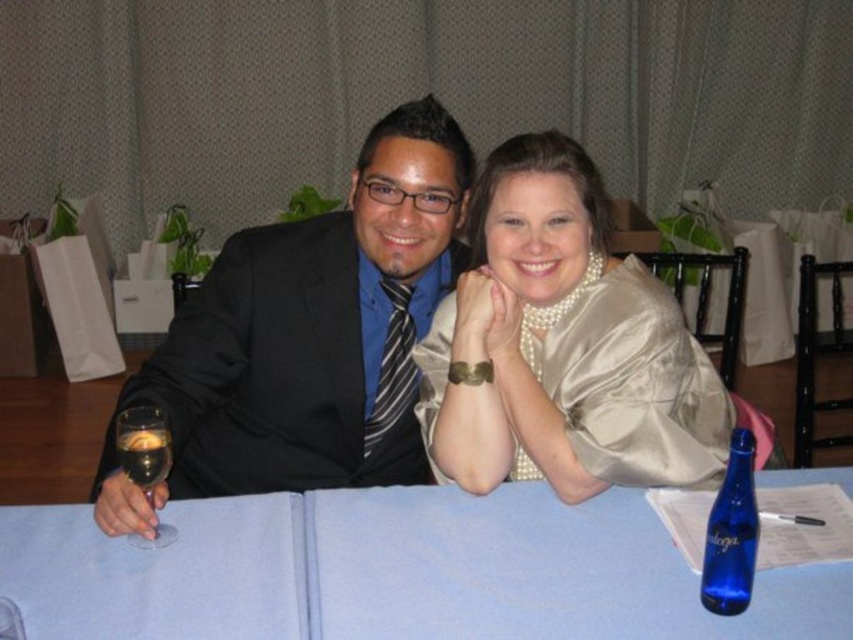
Who is more distant from viewer, [579,227] or [747,476]?

Positioned behind is point [579,227].

Where is `satin gold dress at center`? The width and height of the screenshot is (853, 640). satin gold dress at center is located at coordinates (561, 346).

Where is `satin gold dress at center`? Image resolution: width=853 pixels, height=640 pixels. satin gold dress at center is located at coordinates (561, 346).

Can you confirm if black satin suit at center is shorter than clear glass wine glass at left?

Incorrect, black satin suit at center's height does not fall short of clear glass wine glass at left's.

Consider the image. Who is shorter, black satin suit at center or clear glass wine glass at left?

Standing shorter between the two is clear glass wine glass at left.

Is point (318, 273) positioned before point (138, 465)?

That is False.

Locate an element on the screen. The height and width of the screenshot is (640, 853). black satin suit at center is located at coordinates (317, 328).

Is blue fabric table at center above black satin suit at center?

Incorrect, blue fabric table at center is not positioned above black satin suit at center.

Can you confirm if blue fabric table at center is taller than black satin suit at center?

In fact, blue fabric table at center may be shorter than black satin suit at center.

Which is behind, point (277, 612) or point (250, 401)?

Positioned behind is point (250, 401).

At what (x,y) coordinates should I click in order to perform the action: click on blue fabric table at center. Please return your answer as a coordinate pair (x, y). Looking at the image, I should click on (393, 572).